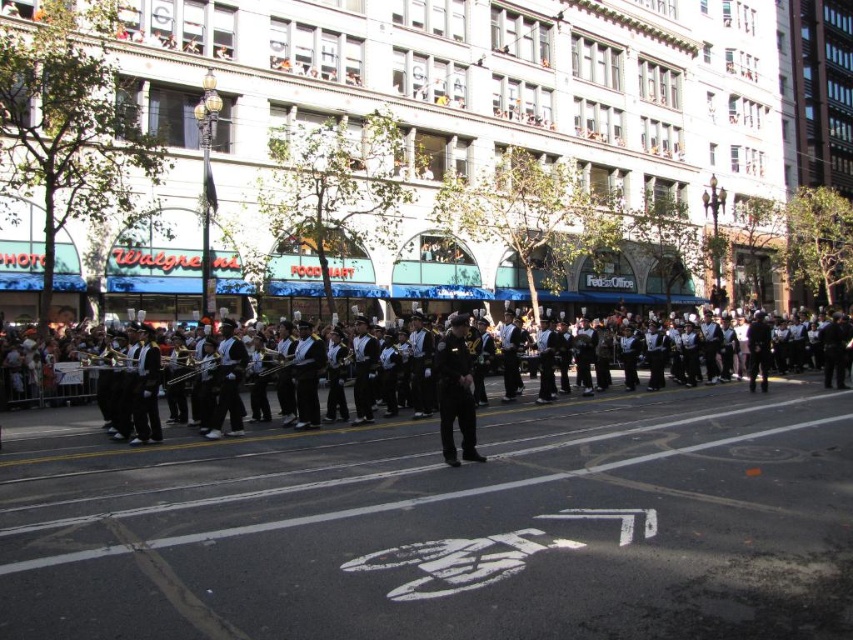
You are standing at the center of the street and see the point marked at coordinates (456,392). What object is located at that point?

The point at coordinates (456,392) marks the location of the black uniform, which belongs to the conductor leading the marching band in the center of the scene.

Looking at this image, you are a photographer standing on the sidewalk and want to take a photo of the black uniformed band at center and the black uniform at center. Which one appears taller in the photo?

The black uniformed band at center is not as tall as black uniform at center, so the black uniform at center appears taller in the photo.

You are a photographer standing on the sidewalk. You want to take a photo of the black uniformed band at center and the shiny silver trumpet at center. Which object should you zoom in on to capture more details of it in the photo?

You should zoom in on the shiny silver trumpet at center because it is smaller in size compared to the black uniformed band at center, which is wider. Zooming in on the trumpet will allow you to capture its details more clearly.